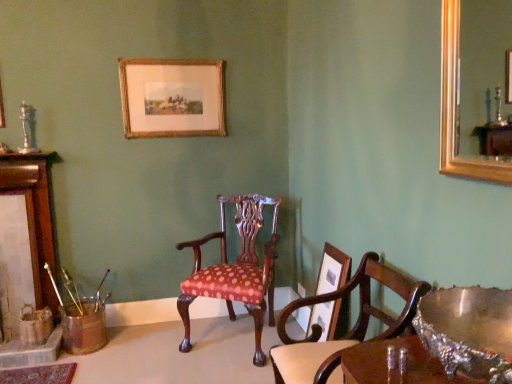
The image size is (512, 384). I want to click on free spot above gold-framed print at upper center, which appears as the 2th picture frame when viewed from the front (from a real-world perspective), so tap(168, 59).